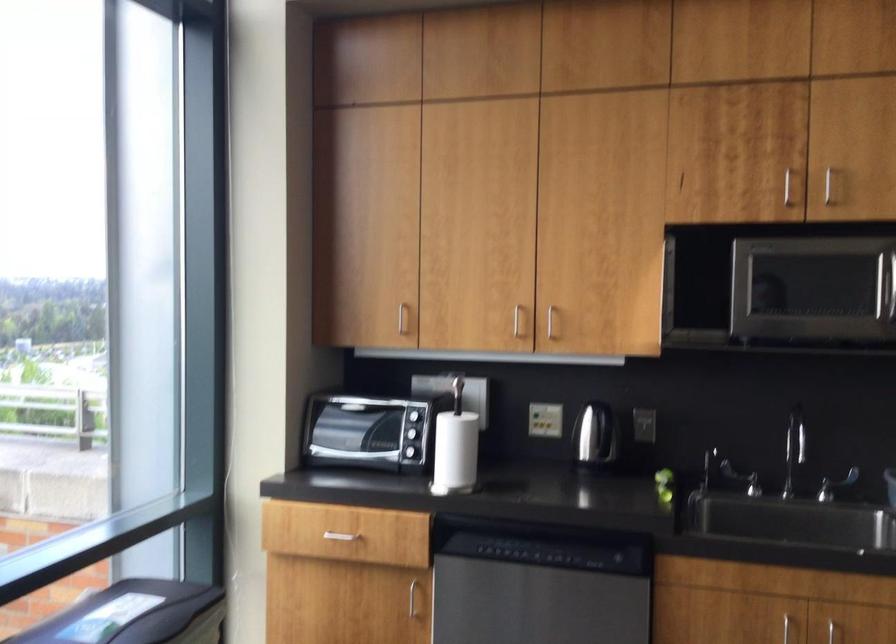
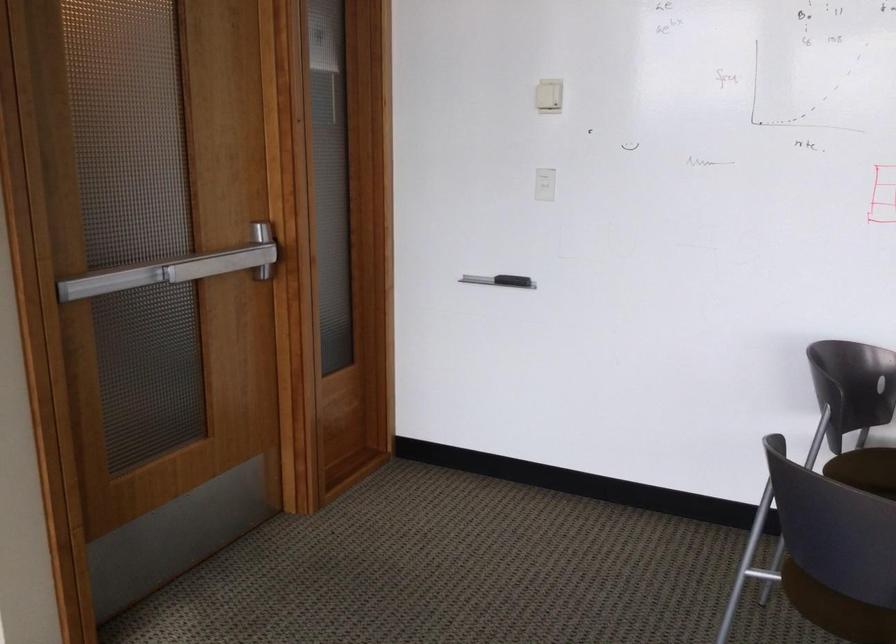
Question: The camera is either moving clockwise (left) or counter-clockwise (right) around the object. The first image is from the beginning of the video and the second image is from the end. Is the camera moving left or right when shooting the video?

Choices:
 (A) Left
 (B) Right

Answer: (A)